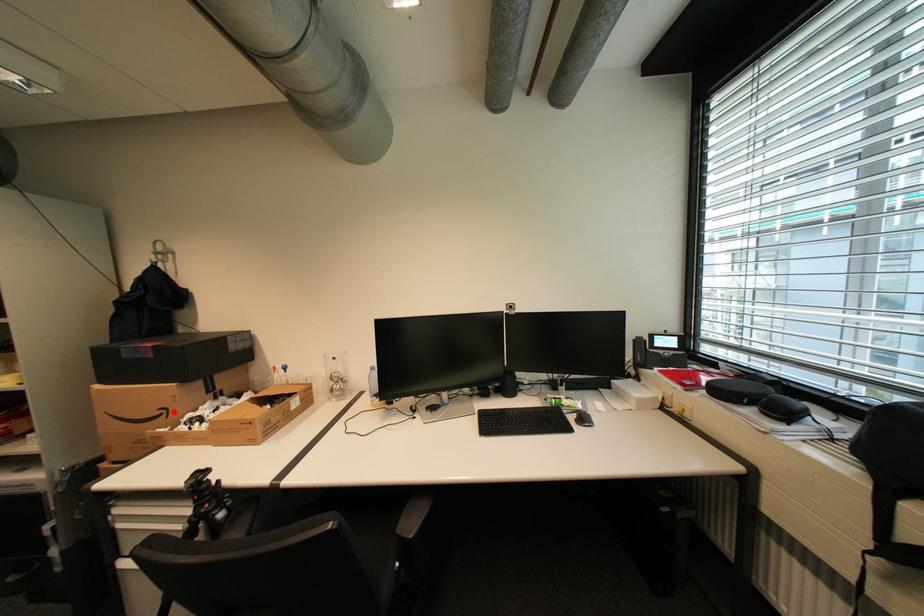
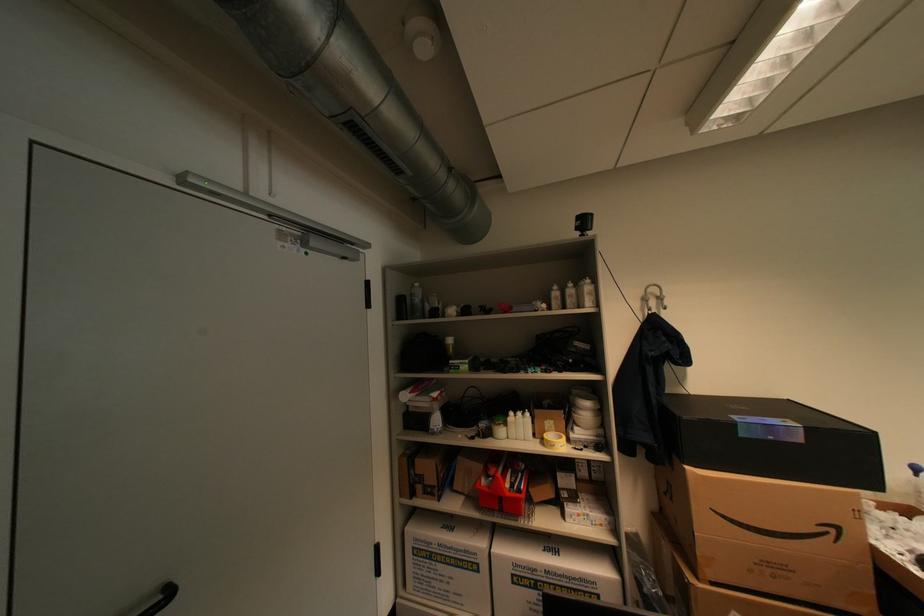
Question: I am providing you with two images of the same scene from different viewpoints. Image1 has a red point marked. In image2, the corresponding 3D location appears at what relative position? Reply with the corresponding letter.

Choices:
 (A) Closer
 (B) Farther

Answer: (A)